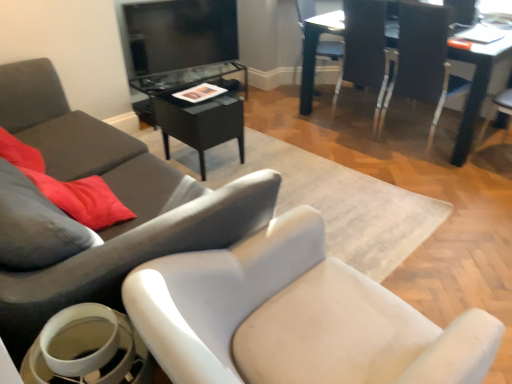
You are a GUI agent. You are given a task and a screenshot of the screen. Output one action in this format:
    pyautogui.click(x=<x>, y=<y>)
    Task: Click on the free location to the right of white glossy chair at upper right, the fourth chair viewed from the left
    The width and height of the screenshot is (512, 384).
    Given the screenshot: What is the action you would take?
    pyautogui.click(x=411, y=115)